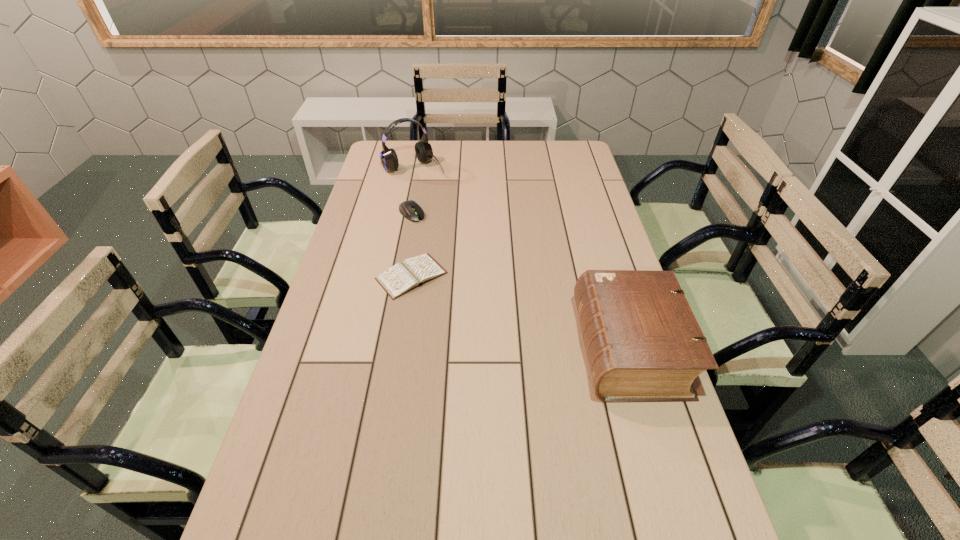
I want to click on the third closest object relative to the headset, so click(643, 342).

Locate which object ranks in proximity to the headset. Please provide its 2D coordinates. Your answer should be formatted as a tuple, i.e. [(x, y)], where the tuple contains the x and y coordinates of a point satisfying the conditions above.

[(409, 209)]

The image size is (960, 540). In order to click on vacant region that satisfies the following two spatial constraints: 1. on the front side of the Bible; 2. on the spine side of the third tallest object in this screenshot , I will do `click(386, 348)`.

In order to click on free location that satisfies the following two spatial constraints: 1. on the front side of the nearest object; 2. on the spine side of the second farthest object in this screenshot , I will do `click(386, 348)`.

Identify the location of vacant space that satisfies the following two spatial constraints: 1. on the front side of the second farthest object; 2. on the spine side of the nearest object. This screenshot has width=960, height=540. (386, 348).

Where is `free spot that satisfies the following two spatial constraints: 1. on the front side of the third farthest object; 2. on the spine side of the second tallest object`? free spot that satisfies the following two spatial constraints: 1. on the front side of the third farthest object; 2. on the spine side of the second tallest object is located at coordinates (400, 348).